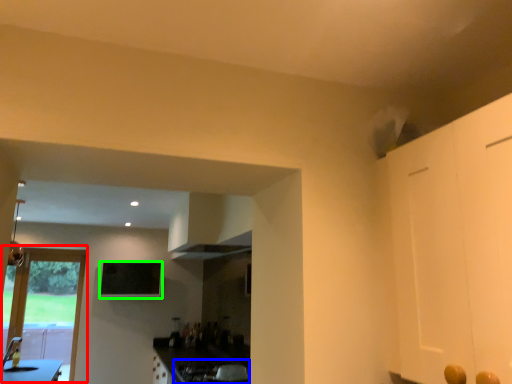
Question: Based on their relative distances, which object is farther from door (highlighted by a red box)? Choose from gas stove (highlighted by a blue box) and window screen (highlighted by a green box).

Choices:
 (A) gas stove
 (B) window screen

Answer: (A)